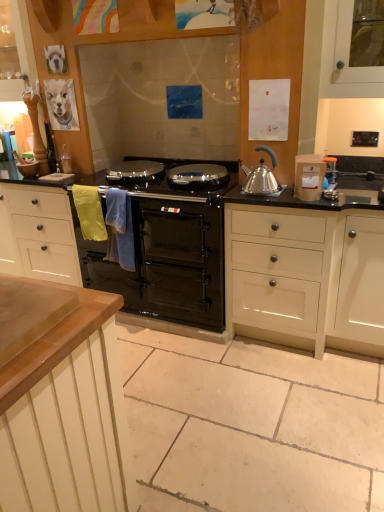
Question: Is satin silver kettle at right looking in the opposite direction of wooden cabinet at upper left, which is counted as the 2th cabinetry, starting from the bottom?

Choices:
 (A) no
 (B) yes

Answer: (A)

Question: Is satin silver kettle at right thinner than wooden cabinet at upper left, placed as the second cabinetry when sorted from right to left?

Choices:
 (A) no
 (B) yes

Answer: (B)

Question: From the image's perspective, would you say satin silver kettle at right is shown under wooden cabinet at upper left, which is the first cabinetry in top-to-bottom order?

Choices:
 (A) yes
 (B) no

Answer: (A)

Question: From a real-world perspective, is satin silver kettle at right physically below wooden cabinet at upper left, placed as the second cabinetry when sorted from right to left?

Choices:
 (A) yes
 (B) no

Answer: (A)

Question: Considering the relative sizes of satin silver kettle at right and wooden cabinet at upper left, placed as the 1th cabinetry when sorted from left to right, in the image provided, is satin silver kettle at right wider than wooden cabinet at upper left, placed as the 1th cabinetry when sorted from left to right,?

Choices:
 (A) yes
 (B) no

Answer: (B)

Question: In terms of width, does wooden cabinet at upper left, placed as the 1th cabinetry when sorted from left to right, look wider or thinner when compared to satin silver kettle at right?

Choices:
 (A) thin
 (B) wide

Answer: (B)

Question: Does point (34, 72) appear closer or farther from the camera than point (261, 189)?

Choices:
 (A) farther
 (B) closer

Answer: (A)

Question: Is wooden cabinet at upper left, which is the first cabinetry in top-to-bottom order, bigger or smaller than satin silver kettle at right?

Choices:
 (A) big
 (B) small

Answer: (A)

Question: In the image, is wooden cabinet at upper left, which is the first cabinetry in top-to-bottom order, positioned in front of or behind satin silver kettle at right?

Choices:
 (A) behind
 (B) front

Answer: (A)

Question: From their relative heights in the image, would you say black glass oven at center is taller or shorter than white matte container at right?

Choices:
 (A) short
 (B) tall

Answer: (B)

Question: Considering the positions of black glass oven at center and white matte container at right in the image, is black glass oven at center wider or thinner than white matte container at right?

Choices:
 (A) thin
 (B) wide

Answer: (B)

Question: Is point (87, 246) positioned closer to the camera than point (299, 192)?

Choices:
 (A) closer
 (B) farther

Answer: (B)

Question: Would you say black glass oven at center is to the left or to the right of white matte container at right in the picture?

Choices:
 (A) right
 (B) left

Answer: (B)

Question: Relative to black glass oven at center, is wooden cabinet at upper left, which is the first cabinetry in top-to-bottom order, in front or behind?

Choices:
 (A) front
 (B) behind

Answer: (B)

Question: Is wooden cabinet at upper left, placed as the second cabinetry when sorted from right to left, spatially inside black glass oven at center, or outside of it?

Choices:
 (A) inside
 (B) outside

Answer: (B)